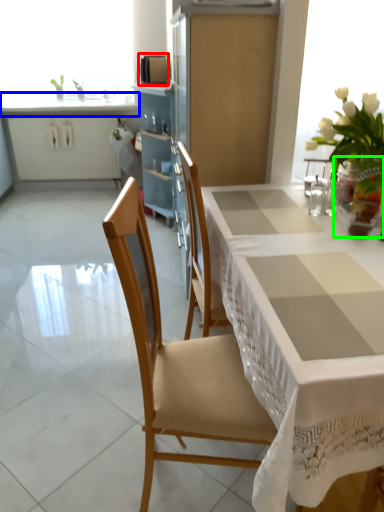
Question: Which object is the farthest from appliance (highlighted by a red box)? Choose among these: countertop (highlighted by a blue box) or vase (highlighted by a green box).

Choices:
 (A) countertop
 (B) vase

Answer: (B)